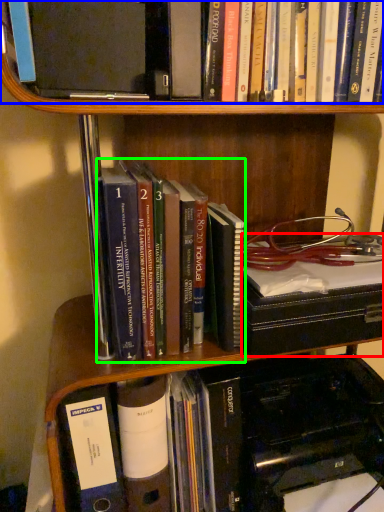
Question: Which object is positioned farthest from book (highlighted by a red box)? Select from book (highlighted by a blue box) and book (highlighted by a green box).

Choices:
 (A) book
 (B) book

Answer: (A)